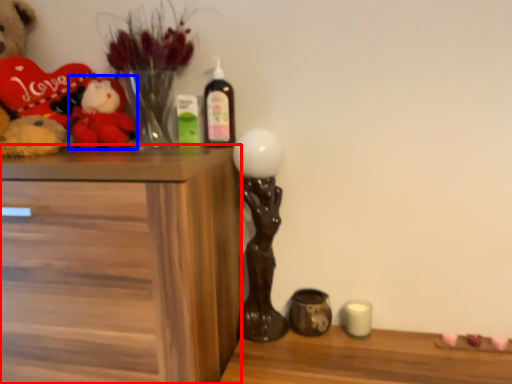
Question: Among these objects, which one is nearest to the camera, chest of drawers (highlighted by a red box) or toy (highlighted by a blue box)?

Choices:
 (A) chest of drawers
 (B) toy

Answer: (A)